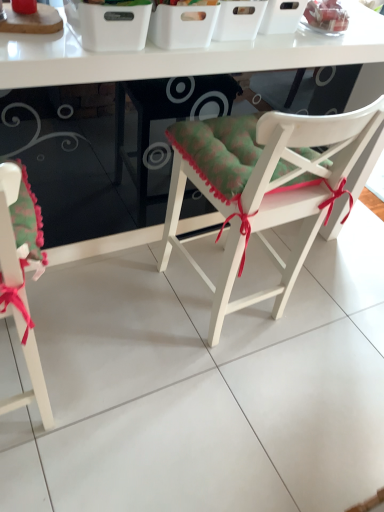
You are a GUI agent. You are given a task and a screenshot of the screen. Output one action in this format:
    pyautogui.click(x=<x>, y=<y>)
    Task: Click on the free point to the right of matte green cushion at lower left, acting as the 2th chair starting from the right
    The image size is (384, 512).
    Given the screenshot: What is the action you would take?
    point(107,395)